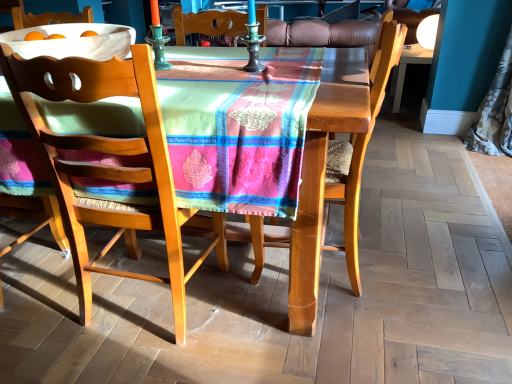
Question: In the image, is matte black desk at upper right on the left side or the right side of wooden chair with woven seat at center, arranged as the first chair when viewed from the left?

Choices:
 (A) right
 (B) left

Answer: (A)

Question: In the image, is matte black desk at upper right positioned in front of or behind wooden chair with woven seat at center, the second chair positioned from the right?

Choices:
 (A) front
 (B) behind

Answer: (B)

Question: Estimate the real-world distances between objects in this image. Which object is closer to the matte black desk at upper right?

Choices:
 (A) wooden chair at center, arranged as the second chair when viewed from the left
 (B) silky floral curtain at right
 (C) wooden chair with woven seat at center, arranged as the first chair when viewed from the left

Answer: (B)

Question: Which object is the closest to the wooden chair at center, arranged as the second chair when viewed from the left?

Choices:
 (A) wooden chair with woven seat at center, arranged as the first chair when viewed from the left
 (B) silky floral curtain at right
 (C) matte black desk at upper right

Answer: (A)